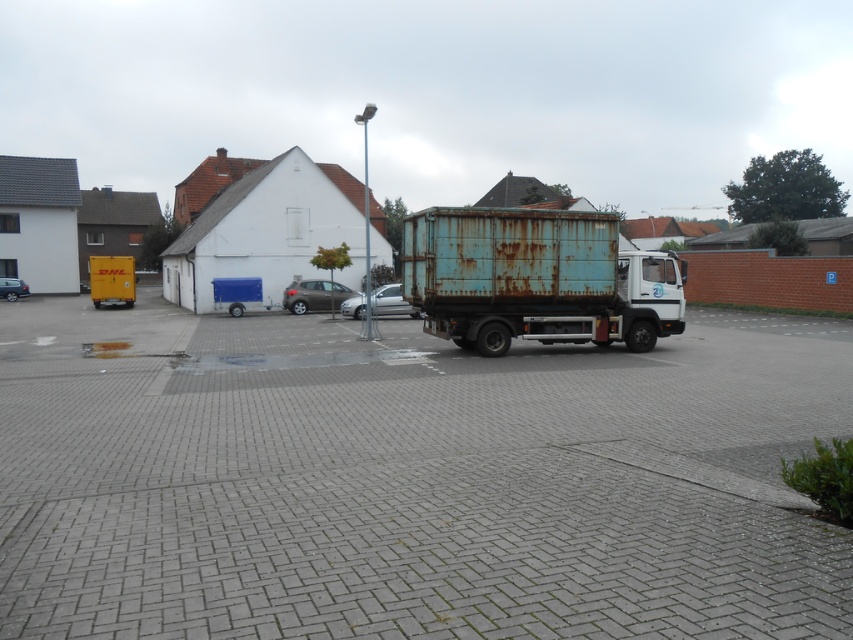
Question: Which of the following is the farthest from the observer?

Choices:
 (A) silver metallic car at center
 (B) satin brown hatchback at center
 (C) rusty metal truck at center

Answer: (B)

Question: Is satin brown hatchback at center further to the viewer compared to silver metallic car at center?

Choices:
 (A) yes
 (B) no

Answer: (A)

Question: Is yellow matte truck at left wider than metallic silver car at lower left?

Choices:
 (A) no
 (B) yes

Answer: (B)

Question: Considering the relative positions of rusty metal truck at center and yellow matte truck at left in the image provided, where is rusty metal truck at center located with respect to yellow matte truck at left?

Choices:
 (A) above
 (B) below

Answer: (B)

Question: Which point is closer to the camera taking this photo?

Choices:
 (A) (337, 282)
 (B) (439, 250)

Answer: (B)

Question: Which object is positioned closest to the yellow matte truck at left?

Choices:
 (A) metallic silver car at lower left
 (B) rusty metal truck at center

Answer: (A)